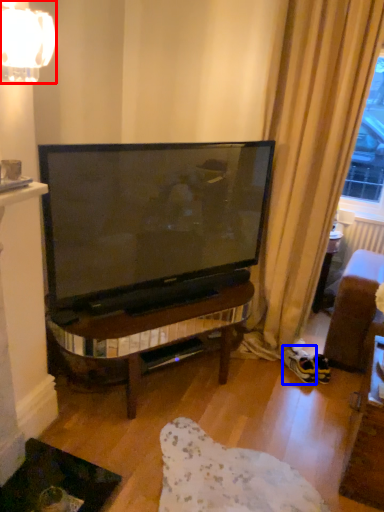
Question: Which of the following is the closest to the observer, lamp (highlighted by a red box) or footwear (highlighted by a blue box)?

Choices:
 (A) lamp
 (B) footwear

Answer: (A)